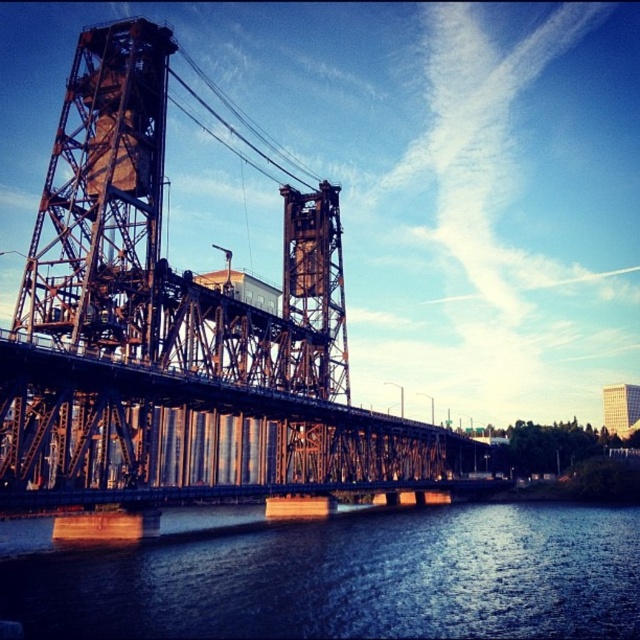
Where is `black steel bridge at center`? black steel bridge at center is located at coordinates (180, 336).

Who is more distant from viewer, (92, 115) or (284, 628)?

The point (92, 115) is more distant.

Measure the distance between point (104, 381) and camera.

Point (104, 381) and camera are 59.34 meters apart from each other.

What are the coordinates of `black steel bridge at center` in the screenshot? It's located at (180, 336).

Is point (317, 264) in front of point (604, 408)?

That is True.

You are a GUI agent. You are given a task and a screenshot of the screen. Output one action in this format:
    pyautogui.click(x=<x>, y=<y>)
    Task: Click on the black steel bridge at center
    This screenshot has width=640, height=640.
    Given the screenshot: What is the action you would take?
    pyautogui.click(x=180, y=336)

Between metallic wire at upper center and white glass building at upper right, which one is positioned lower?

white glass building at upper right

Can you confirm if metallic wire at upper center is positioned to the left of white glass building at upper right?

Indeed, metallic wire at upper center is positioned on the left side of white glass building at upper right.

At what (x,y) coordinates should I click in order to perform the action: click on metallic wire at upper center. Please return your answer as a coordinate pair (x, y). Looking at the image, I should click on (232, 125).